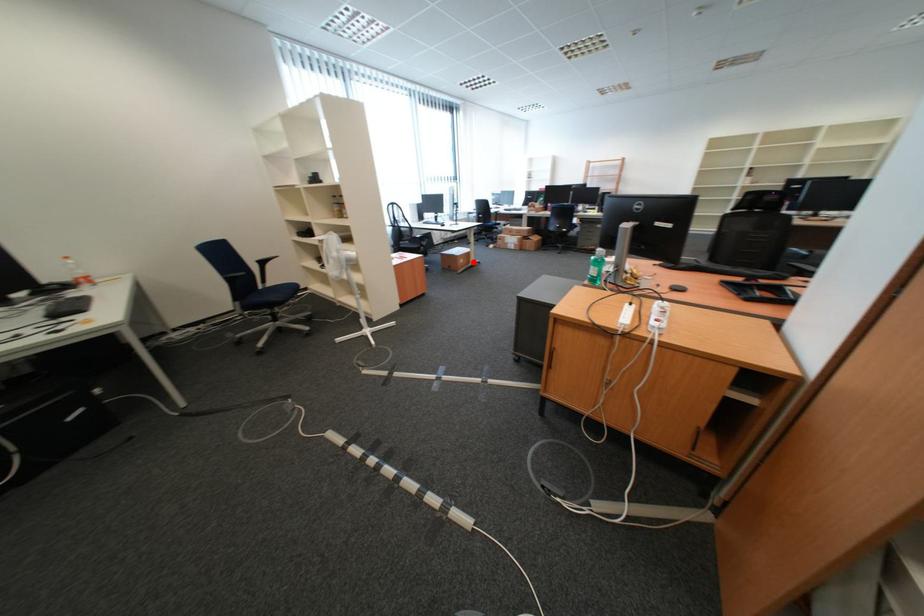
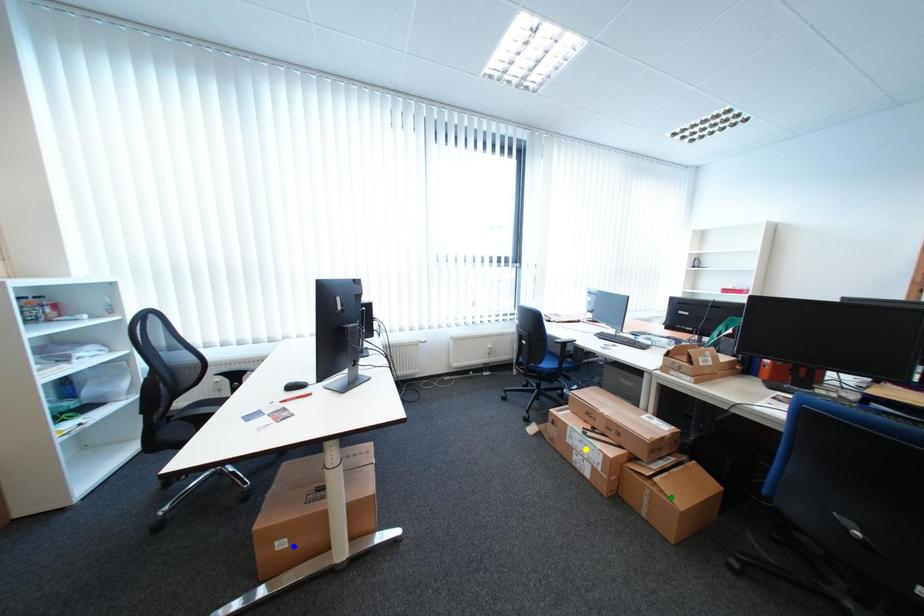
Question: I am providing you with two images of the same scene from different viewpoints. A red point is marked on the first image. You are given multiple points on the second image. In image 2, which mark is for the same physical point as the one in image 1?

Choices:
 (A) blue point
 (B) yellow point
 (C) green point

Answer: (A)